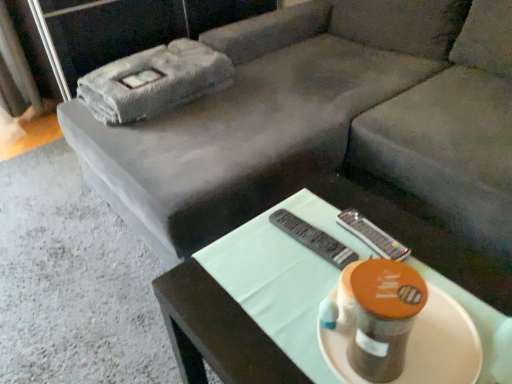
Describe the element at coordinates (278, 272) in the screenshot. I see `matte black table at center` at that location.

Find the location of a particular element. This screenshot has height=384, width=512. matte black table at center is located at coordinates (278, 272).

Is matte black table at center a part of gray fabric couch at center?

No.

From a real-world perspective, who is located higher, gray fabric couch at center or matte black table at center?

In real-world perspective, gray fabric couch at center is above.

How far apart are gray fabric couch at center and matte black table at center?

gray fabric couch at center is 23.07 inches away from matte black table at center.

Is the depth of gray fabric couch at center greater than that of matte black table at center?

That is True.

At what (x,y) coordinates should I click in order to perform the action: click on platter below the gray fabric couch at center (from the image's perspective). Please return your answer as a coordinate pair (x, y). This screenshot has height=384, width=512. Looking at the image, I should click on (442, 344).

Is matte white platter at center oriented away from gray fabric couch at center?

matte white platter at center does not have its back to gray fabric couch at center.

Does point (457, 356) come farther from viewer compared to point (384, 180)?

No, (457, 356) is closer to viewer.

Which is more to the right, matte white platter at center or gray fabric couch at center?

matte white platter at center is more to the right.

Where is `platter on the right of black plastic remote at center`? This screenshot has height=384, width=512. platter on the right of black plastic remote at center is located at coordinates (442, 344).

Is black plastic remote at center not within matte white platter at center?

Yes.

Considering the relative positions of black plastic remote at center and matte white platter at center in the image provided, is black plastic remote at center to the right of matte white platter at center from the viewer's perspective?

No, black plastic remote at center is not to the right of matte white platter at center.

Considering the points (274, 225) and (439, 343), which point is behind, point (274, 225) or point (439, 343)?

Point (274, 225)

Can we say matte black table at center lies outside matte white platter at center?

Yes, matte black table at center is located beyond the bounds of matte white platter at center.

Where is `platter located on the right of matte black table at center`? platter located on the right of matte black table at center is located at coordinates (442, 344).

From the image's perspective, who appears lower, matte black table at center or matte white platter at center?

From the image's view, matte black table at center is below.

Considering the sizes of objects matte black table at center and matte white platter at center in the image provided, who is wider, matte black table at center or matte white platter at center?

matte black table at center is wider.

Is black plastic remote at center smaller than matte black table at center?

Correct, black plastic remote at center occupies less space than matte black table at center.

Can you confirm if black plastic remote at center is taller than matte black table at center?

No.

Which is closer, (x=295, y=239) or (x=501, y=339)?

Point (x=295, y=239) is positioned farther from the camera compared to point (x=501, y=339).

Which object is closer to the camera taking this photo, black plastic remote at center or matte black table at center?

matte black table at center is closer to the camera.

Are matte white platter at center and matte black table at center far apart?

They are positioned close to each other.

Which of these two, matte white platter at center or matte black table at center, is bigger?

Bigger between the two is matte black table at center.

Which of these two, matte white platter at center or matte black table at center, stands shorter?

matte white platter at center.

Is matte white platter at center turned away from matte black table at center?

No.

Which is in front, point (154, 204) or point (411, 345)?

Positioned in front is point (411, 345).

Could you tell me if gray fabric couch at center is turned towards matte white platter at center?

No, gray fabric couch at center is not aimed at matte white platter at center.

From the image's perspective, is gray fabric couch at center above or below matte white platter at center?

Clearly, from the image's perspective, gray fabric couch at center is above matte white platter at center.

Can you confirm if gray fabric couch at center is smaller than matte white platter at center?

Actually, gray fabric couch at center might be larger than matte white platter at center.

Locate an element on the screen. table that appears below the gray fabric couch at center (from a real-world perspective) is located at coordinates (278, 272).

You are a GUI agent. You are given a task and a screenshot of the screen. Output one action in this format:
    pyautogui.click(x=<x>, y=<y>)
    Task: Click on the studio couch that appears above the matte white platter at center (from the image's perspective)
    This screenshot has width=512, height=384.
    Given the screenshot: What is the action you would take?
    pyautogui.click(x=334, y=134)

Which object lies nearer to the anchor point black plastic remote at center, gray fabric couch at center or matte black table at center?

matte black table at center is closer to black plastic remote at center.

In the scene shown: Which object lies nearer to the anchor point matte white platter at center, matte black table at center or gray fabric couch at center?

matte black table at center is closer to matte white platter at center.

Which object lies nearer to the anchor point gray fabric couch at center, matte black table at center or black plastic remote at center?

Based on the image, matte black table at center appears to be nearer to gray fabric couch at center.

Looking at this image, looking at the image, which one is located closer to black plastic remote at center, matte white platter at center or matte black table at center?

matte black table at center.

Looking at the image, which one is located further to black plastic remote at center, matte white platter at center or gray fabric couch at center?

gray fabric couch at center lies further to black plastic remote at center than the other object.

From the image, which object appears to be nearer to matte white platter at center, black plastic remote at center or matte black table at center?

Based on the image, matte black table at center appears to be nearer to matte white platter at center.

Which object lies further to the anchor point matte black table at center, gray fabric couch at center or matte white platter at center?

Among the two, gray fabric couch at center is located further to matte black table at center.

From the image, which object appears to be farther from matte white platter at center, black plastic remote at center or gray fabric couch at center?

gray fabric couch at center is further to matte white platter at center.

Image resolution: width=512 pixels, height=384 pixels. In order to click on remote that lies between gray fabric couch at center and matte white platter at center from top to bottom in this screenshot , I will do `click(314, 239)`.

You are a GUI agent. You are given a task and a screenshot of the screen. Output one action in this format:
    pyautogui.click(x=<x>, y=<y>)
    Task: Click on the platter that lies between gray fabric couch at center and matte black table at center from top to bottom
    The image size is (512, 384).
    Given the screenshot: What is the action you would take?
    pyautogui.click(x=442, y=344)

Find the location of `platter between matte black table at center and black plastic remote at center from front to back`. platter between matte black table at center and black plastic remote at center from front to back is located at coordinates (442, 344).

The width and height of the screenshot is (512, 384). Identify the location of remote between gray fabric couch at center and matte black table at center vertically. (314, 239).